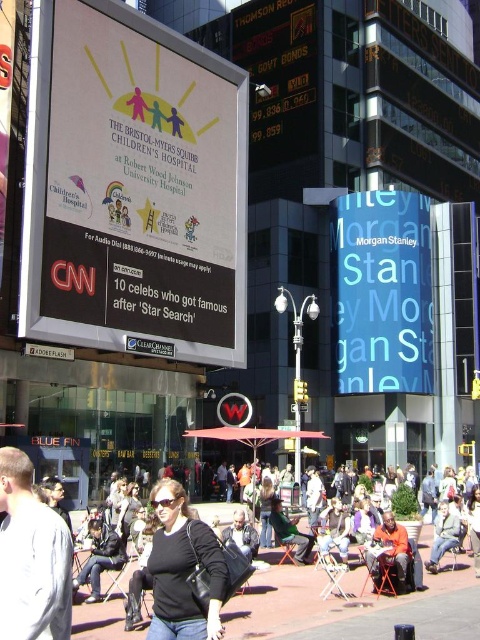
Consider the image. You are a photographer standing in the scene and want to capture both the dark blue jeans at lower left and the dark gray jacket at center in a single photo. Based on their positions, can you frame both subjects so they appear side by side without overlapping?

The dark blue jeans at lower left is to the left of dark gray jacket at center, so they are already positioned side by side horizontally. As long as the camera angle captures both from left to right, they can be framed without overlapping.

You are a photographer standing in the middle of the street. You want to take a photo of the blue glossy morgan stanley sign at upper right and the dark blue jeans at lower left. Which object should you focus on first to ensure both are in the frame?

The blue glossy morgan stanley sign at upper right is closer to you, so focus on it first to ensure both are in the frame.

Based on the photo, you are a delivery person who needs to place a new 2.5 meter wide advertisement board between the blue glossy morgan stanley sign at upper right and the billboard in the foreground. Is there enough space?

The distance between the blue glossy morgan stanley sign at upper right and the billboard in the foreground is 61.72 meters. Since the advertisement board is only 2.5 meters wide, there is more than enough space to place it between them.